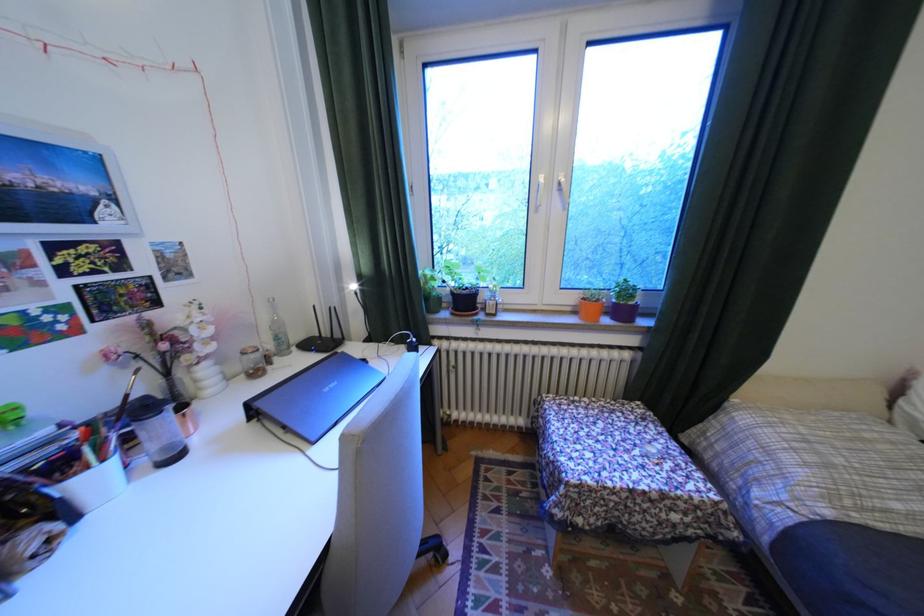
This screenshot has height=616, width=924. In order to click on laptop lid in this screenshot , I will do `click(321, 384)`.